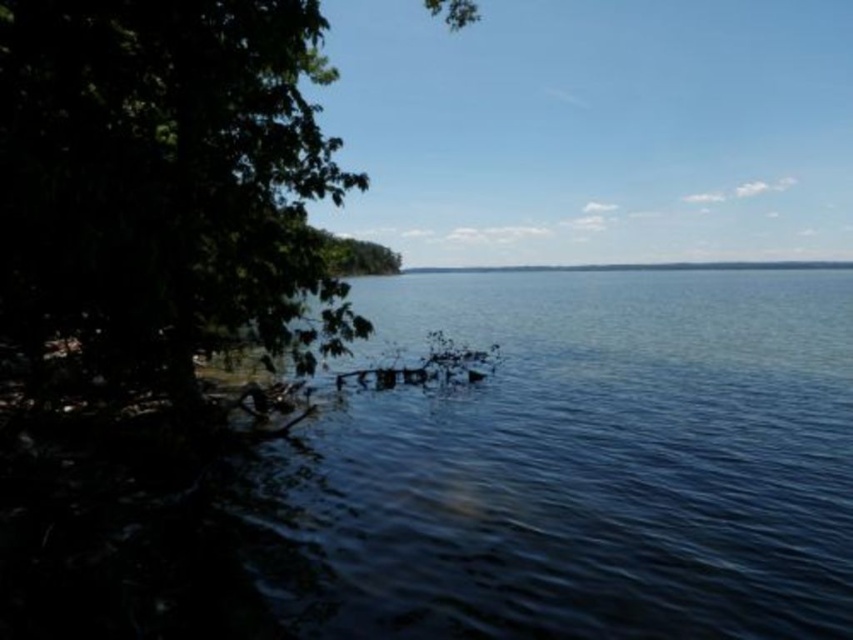
You are standing at the lakeside and want to take a photo of both the green leafy tree at left and the green leafy tree at center. Which tree should you position closer to the camera to ensure both are fully visible in the frame?

You should position the green leafy tree at left closer to the camera because it has a lesser width compared to the green leafy tree at center, allowing both trees to fit within the frame while maintaining visibility.

You are standing at the lakeside and want to take a photo of both the green leafy tree at left and the green leafy tree at center. Which tree should you position closer to the camera to ensure both are in focus?

You should position the green leafy tree at left closer to the camera since it is already closer to the viewer than the green leafy tree at center, ensuring both will be in focus when framed properly.